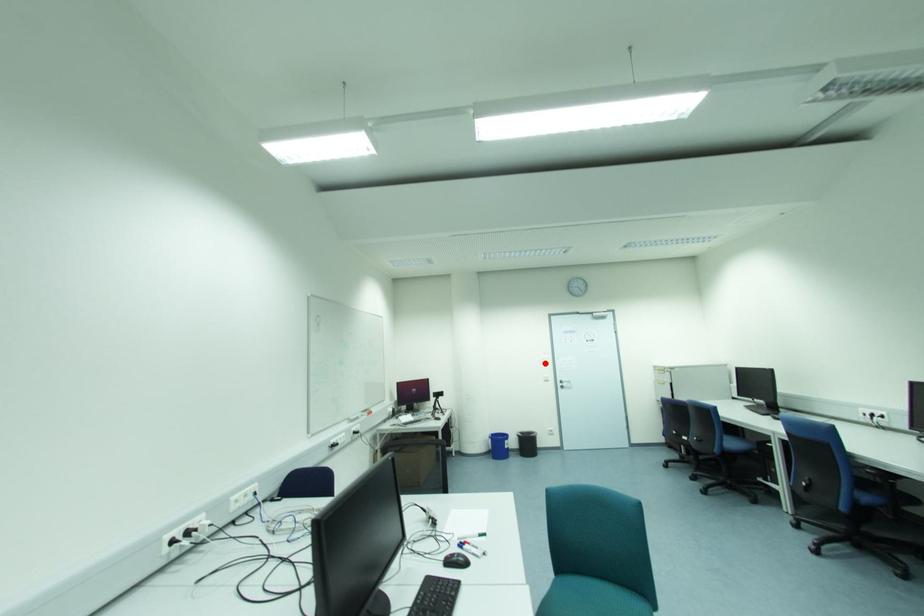
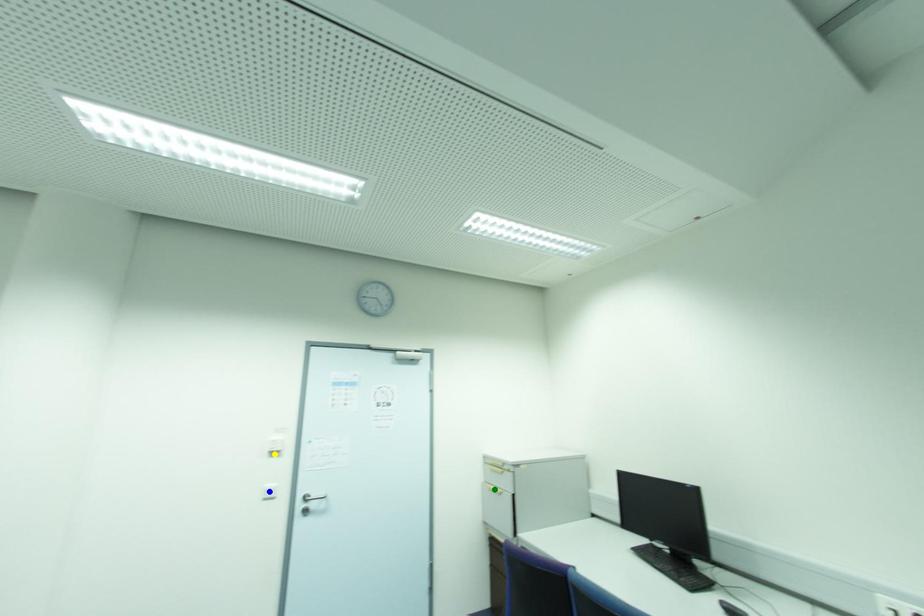
Question: I am providing you with two images of the same scene from different viewpoints. A red point is marked on the first image. You are given multiple points on the second image. Which spot in image 2 lines up with the point in image 1?

Choices:
 (A) yellow point
 (B) green point
 (C) blue point

Answer: (A)